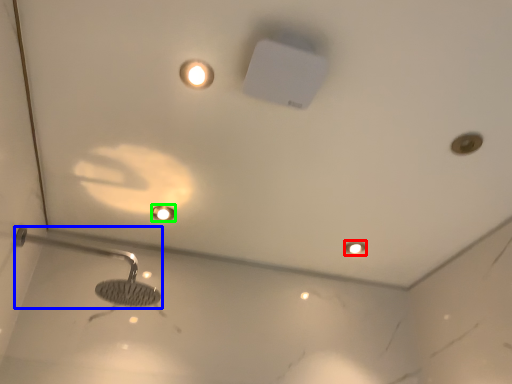
Question: Which object is the closest to the light fixture (highlighted by a red box)? Choose among these: shower (highlighted by a blue box) or droplight (highlighted by a green box).

Choices:
 (A) shower
 (B) droplight

Answer: (B)